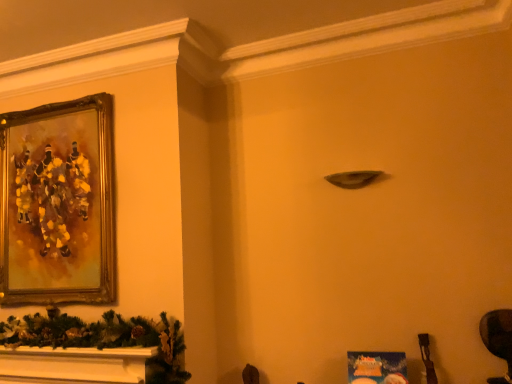
Question: Would you say dark brown leather swivel chair at lower right is inside or outside gold-framed painting at upper left?

Choices:
 (A) outside
 (B) inside

Answer: (A)

Question: From the image's perspective, is dark brown leather swivel chair at lower right positioned above or below gold-framed painting at upper left?

Choices:
 (A) above
 (B) below

Answer: (B)

Question: Based on their positions, is dark brown leather swivel chair at lower right located to the left or right of gold-framed painting at upper left?

Choices:
 (A) right
 (B) left

Answer: (A)

Question: Is gold-framed painting at upper left inside or outside of dark brown leather swivel chair at lower right?

Choices:
 (A) inside
 (B) outside

Answer: (B)

Question: In terms of size, does gold-framed painting at upper left appear bigger or smaller than dark brown leather swivel chair at lower right?

Choices:
 (A) small
 (B) big

Answer: (B)

Question: Does point (96, 130) appear closer or farther from the camera than point (503, 352)?

Choices:
 (A) farther
 (B) closer

Answer: (A)

Question: Considering their positions, is gold-framed painting at upper left located in front of or behind dark brown leather swivel chair at lower right?

Choices:
 (A) behind
 (B) front

Answer: (A)